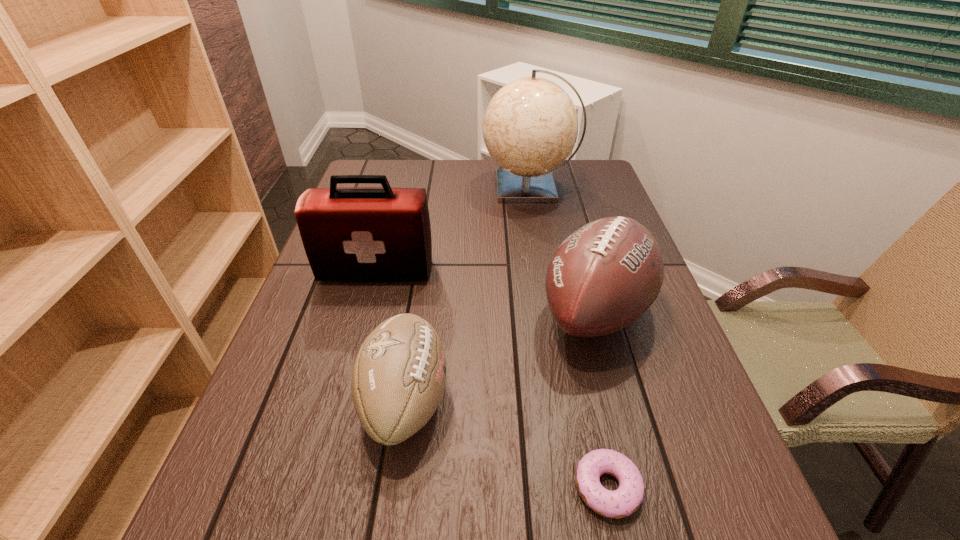
Find the location of a particular element. globe is located at coordinates (530, 127).

What are the coordinates of `the farthest object` in the screenshot? It's located at (530, 127).

The image size is (960, 540). In order to click on the first aid kit in this screenshot , I will do `click(350, 234)`.

What are the coordinates of `the third tallest object` in the screenshot? It's located at (605, 275).

I want to click on the right football (American), so click(605, 275).

At what (x,y) coordinates should I click in order to perform the action: click on the shorter football (American). Please return your answer as a coordinate pair (x, y). This screenshot has width=960, height=540. Looking at the image, I should click on (399, 375).

Locate an element on the screen. The width and height of the screenshot is (960, 540). the left football (American) is located at coordinates (399, 375).

Identify the location of doughnut. (624, 501).

Locate an element on the screen. vacant space located on the surface of the tallest object showing Europe and Africa is located at coordinates (439, 187).

This screenshot has height=540, width=960. What are the coordinates of `vacant space located 0.320m on the surface of the tallest object showing Europe and Africa` in the screenshot? It's located at (382, 187).